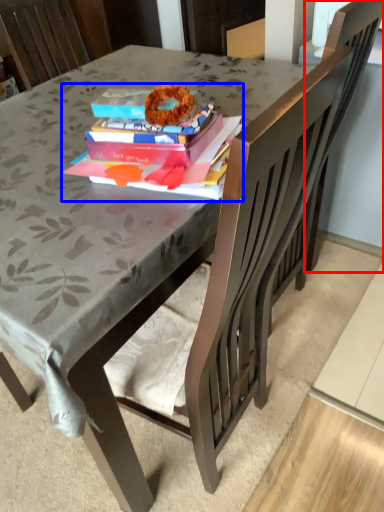
Question: Which object appears farthest to the camera in this image, swivel chair (highlighted by a red box) or book (highlighted by a blue box)?

Choices:
 (A) swivel chair
 (B) book

Answer: (A)